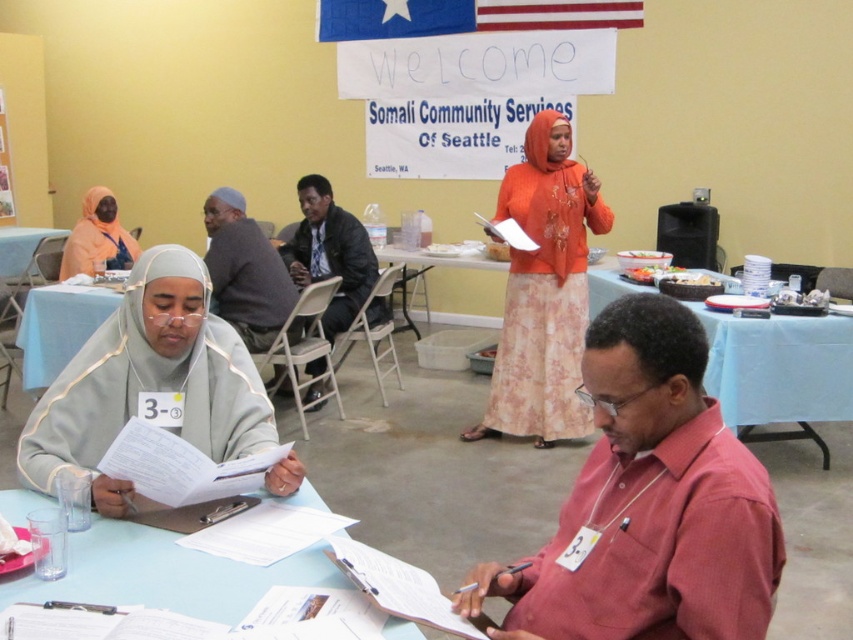
Does point (57, 339) come closer to viewer compared to point (6, 221)?

Yes, point (57, 339) is closer to viewer.

Can you confirm if blue fabric table at lower left is positioned above wooden noticeboard at upper left?

Incorrect, blue fabric table at lower left is not positioned above wooden noticeboard at upper left.

Describe the element at coordinates (57, 326) in the screenshot. I see `blue fabric table at lower left` at that location.

You are a GUI agent. You are given a task and a screenshot of the screen. Output one action in this format:
    pyautogui.click(x=<x>, y=<y>)
    Task: Click on the blue fabric table at lower left
    
    Given the screenshot: What is the action you would take?
    pyautogui.click(x=57, y=326)

Is dark brown leather jacket at center positioned behind blue plastic table at left?

That is False.

Between dark brown leather jacket at center and blue plastic table at left, which one has more height?

Standing taller between the two is dark brown leather jacket at center.

Is point (358, 310) positioned before point (15, 241)?

Yes.

This screenshot has height=640, width=853. What are the coordinates of `dark brown leather jacket at center` in the screenshot? It's located at (329, 253).

Which of these two, light gray fabric hijab at left or dark brown leather jacket at center, stands shorter?

With less height is light gray fabric hijab at left.

Is light gray fabric hijab at left behind dark brown leather jacket at center?

No, light gray fabric hijab at left is closer to the viewer.

Describe the element at coordinates (149, 381) in the screenshot. This screenshot has height=640, width=853. I see `light gray fabric hijab at left` at that location.

You are a GUI agent. You are given a task and a screenshot of the screen. Output one action in this format:
    pyautogui.click(x=<x>, y=<y>)
    Task: Click on the light gray fabric hijab at left
    This screenshot has width=853, height=640.
    Given the screenshot: What is the action you would take?
    pyautogui.click(x=149, y=381)